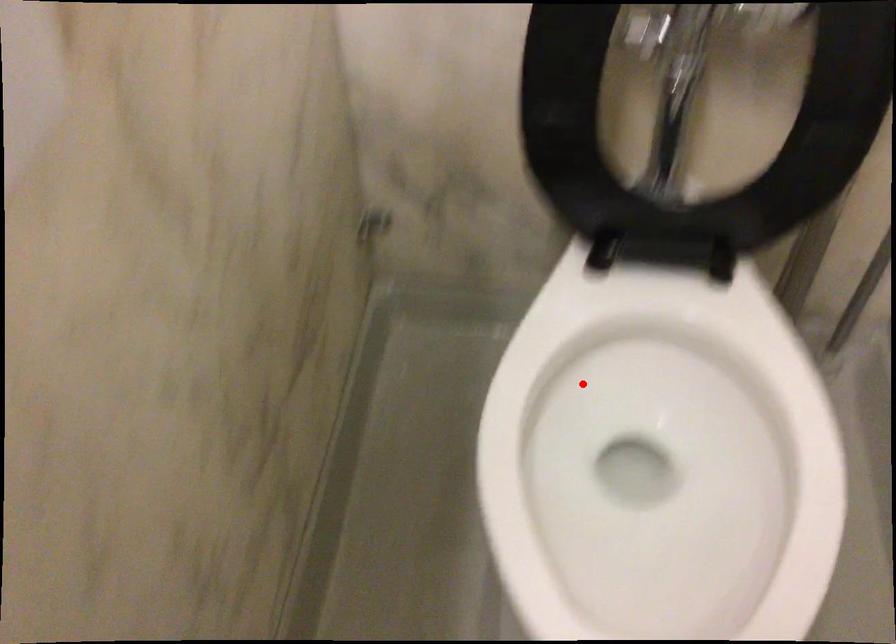
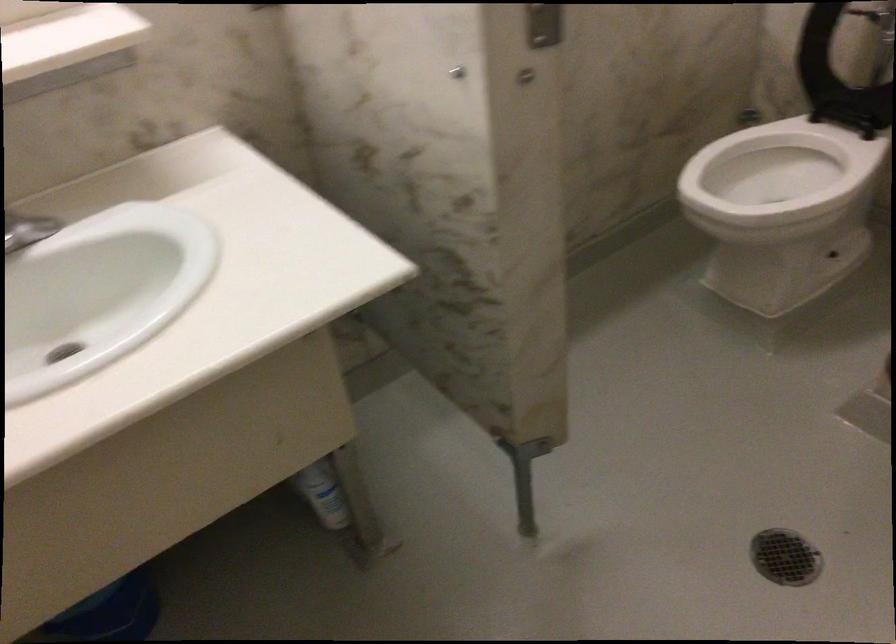
Locate, in the second image, the point that corresponds to the highlighted location in the first image.

(778, 173)